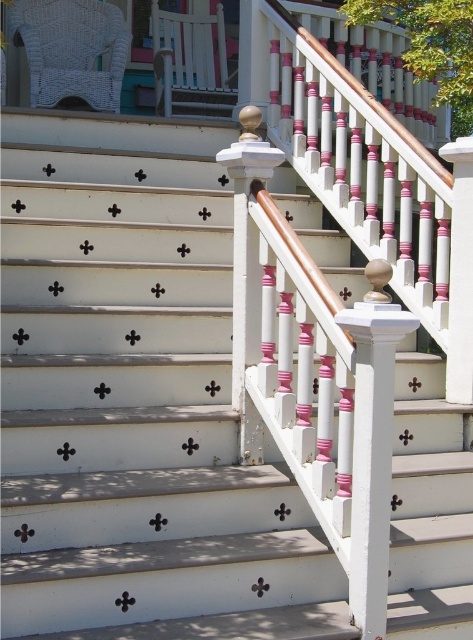
You are standing on the porch and want to move from the white wicker rocking chair at upper left to the white painted wood balustrade at upper center. Which direction should you move to get closer to the balustrade?

You should move backward because the white wicker rocking chair at upper left is in front of the white painted wood balustrade at upper center, meaning the balustrade is behind the chair.

You are standing on the porch and want to move from the white wicker rocking chair at upper left to the white painted wood balustrade at upper center. Which direction should you move to reach it?

You should move to the right to reach the white painted wood balustrade at upper center because the white wicker rocking chair at upper left is located to its left.

You are trying to decide whether to place a small potted plant between the white wicker rocking chair at upper left and the white painted wood balustrade at upper center. Based on their sizes, which object should the plant be placed closer to?

The white wicker rocking chair at upper left is smaller than the white painted wood balustrade at upper center, so the plant should be placed closer to the white wicker rocking chair at upper left to maintain balance.